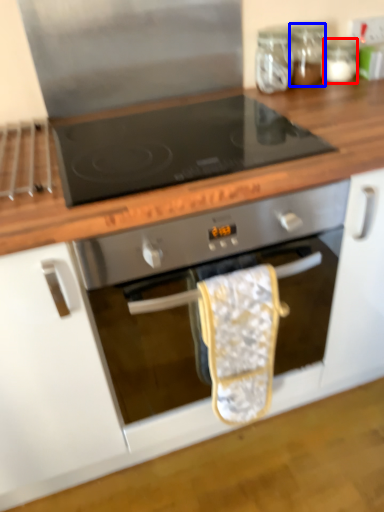
Question: Which point is further to the camera, glass jar (highlighted by a red box) or glass jar (highlighted by a blue box)?

Choices:
 (A) glass jar
 (B) glass jar

Answer: (A)